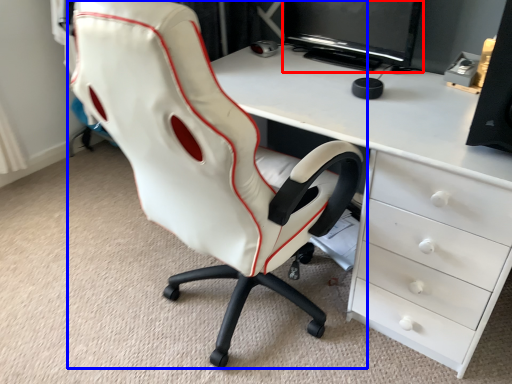
Question: Which object appears farthest to the camera in this image, computer monitor (highlighted by a red box) or chair (highlighted by a blue box)?

Choices:
 (A) computer monitor
 (B) chair

Answer: (A)